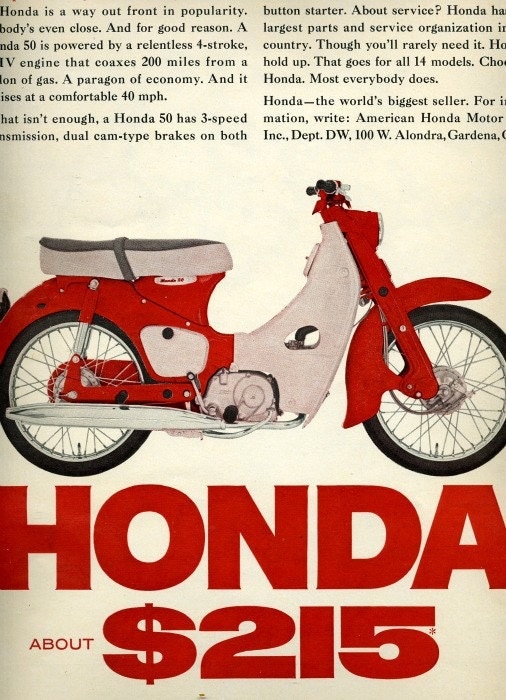
Identify the location of gray and white seat. (157, 248).